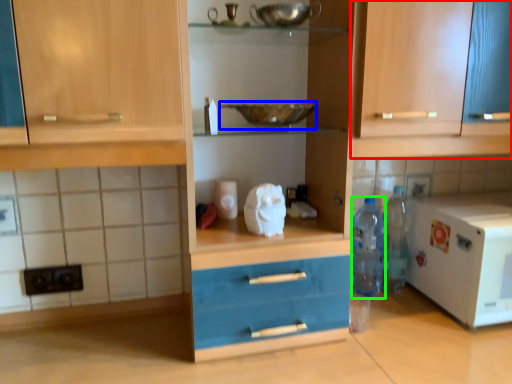
Question: Which object is the farthest from cabinetry (highlighted by a red box)? Choose among these: bowl (highlighted by a blue box) or bottle (highlighted by a green box).

Choices:
 (A) bowl
 (B) bottle

Answer: (B)